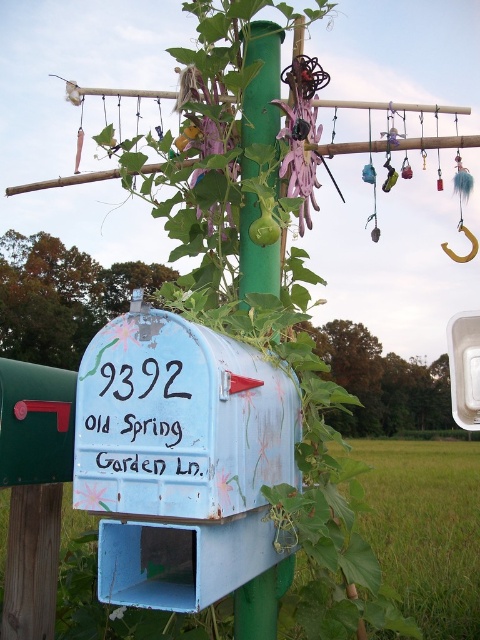
Can you confirm if green matte pole at center is positioned above purple fabric flower at center?

No, green matte pole at center is not above purple fabric flower at center.

Which is behind, point (276, 120) or point (302, 125)?

Positioned behind is point (276, 120).

What are the coordinates of `green matte pole at center` in the screenshot? It's located at pos(262,84).

Image resolution: width=480 pixels, height=640 pixels. In order to click on green matte pole at center in this screenshot , I will do `click(262, 84)`.

Between green matte pole at center and pink paper flower at lower left, which one appears on the right side from the viewer's perspective?

green matte pole at center

Is point (273, 26) less distant than point (93, 490)?

No, (273, 26) is further to viewer.

Locate an element on the screen. green matte pole at center is located at coordinates (262, 84).

Can you confirm if pink paper flower at lower left is positioned to the right of white matte flower at center?

No, pink paper flower at lower left is not to the right of white matte flower at center.

Is pink paper flower at lower left above white matte flower at center?

Incorrect, pink paper flower at lower left is not positioned above white matte flower at center.

Find the location of a particular element. The height and width of the screenshot is (640, 480). pink paper flower at lower left is located at coordinates (94, 493).